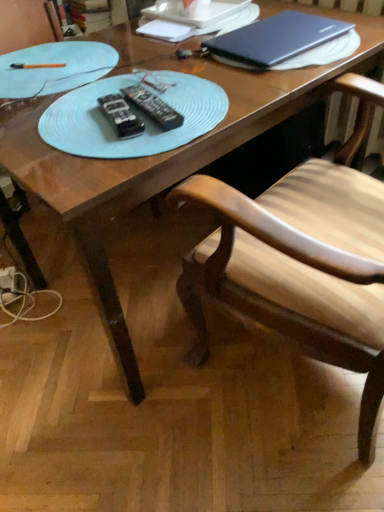
Find the location of `free space below wooden chair at center (from a real-world perspective)`. free space below wooden chair at center (from a real-world perspective) is located at coordinates (292, 388).